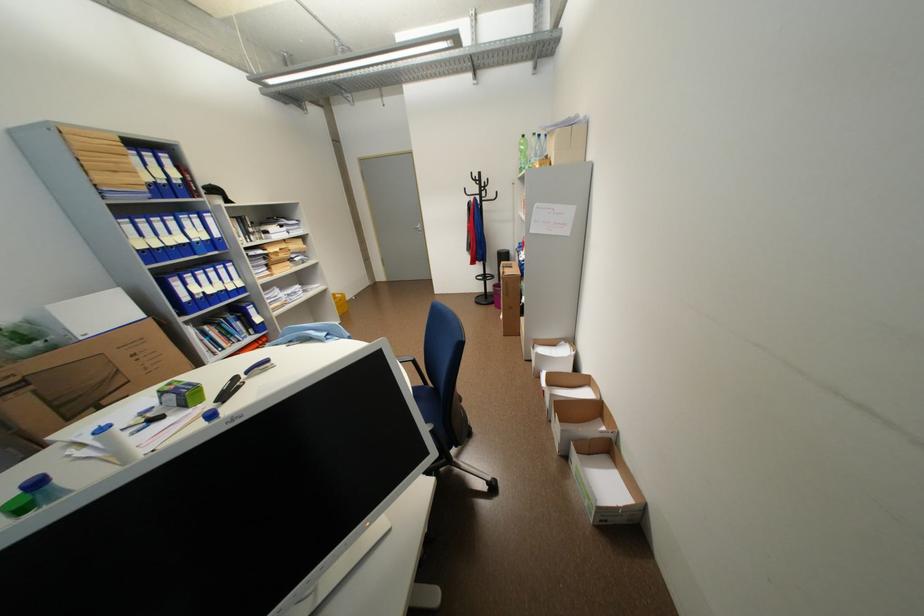
The image size is (924, 616). Describe the element at coordinates (407, 360) in the screenshot. I see `the chair armrest` at that location.